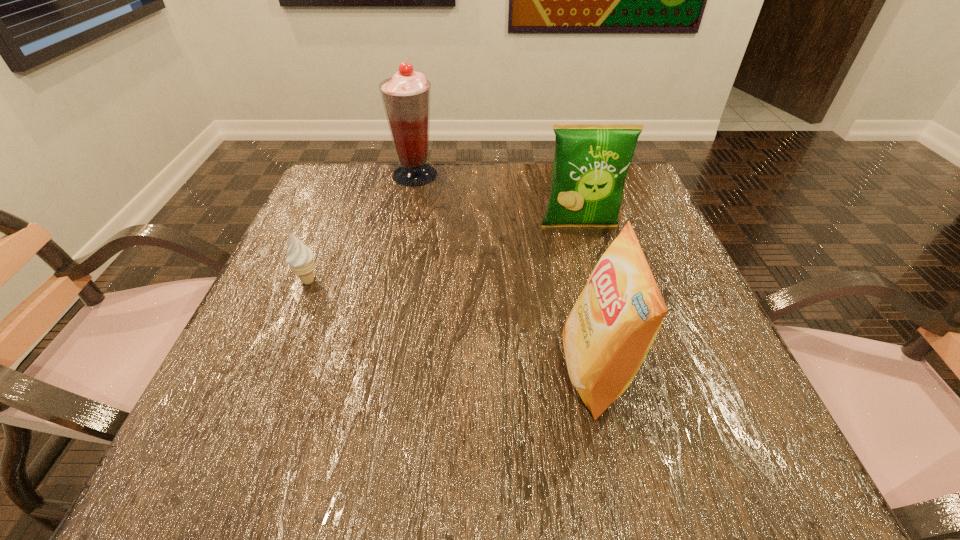
The image size is (960, 540). I want to click on vacant space at the far right corner of the desktop, so click(635, 206).

I want to click on vacant space at the near right corner of the desktop, so click(x=696, y=479).

Locate an element on the screen. This screenshot has width=960, height=540. empty space between the second farthest object and the tallest object is located at coordinates (497, 201).

At what (x,y) coordinates should I click in order to perform the action: click on empty space between the second farthest object and the third farthest object. Please return your answer as a coordinate pair (x, y). Looking at the image, I should click on click(444, 254).

Identify the location of free space between the second farthest object and the farthest object. This screenshot has width=960, height=540. (497, 201).

Locate an element on the screen. vacant region between the tallest object and the nearest object is located at coordinates (505, 273).

Where is `vacant point located between the leftmost object and the nearest object`? vacant point located between the leftmost object and the nearest object is located at coordinates (452, 326).

Identify the location of blank region between the farther crisp (potato chip) and the shortest object. (444, 254).

Locate an element on the screen. This screenshot has height=540, width=960. free space between the icecream and the farther crisp (potato chip) is located at coordinates (444, 254).

Where is `vacant point located between the nearer crisp (potato chip) and the third farthest object`? This screenshot has height=540, width=960. vacant point located between the nearer crisp (potato chip) and the third farthest object is located at coordinates (452, 326).